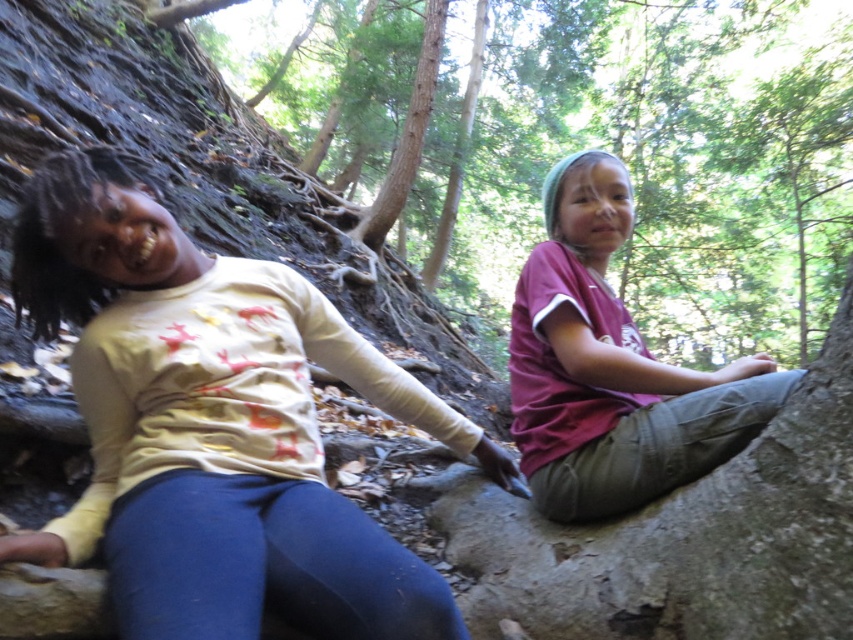
Does green leafy tree at upper center have a greater width compared to maroon fabric shirt at center?

Indeed, green leafy tree at upper center has a greater width compared to maroon fabric shirt at center.

Is green leafy tree at upper center above maroon fabric shirt at center?

Yes, green leafy tree at upper center is above maroon fabric shirt at center.

Which is behind, point (753, 236) or point (596, 497)?

Point (753, 236)

This screenshot has width=853, height=640. I want to click on green leafy tree at upper center, so click(x=674, y=161).

Can you confirm if green leafy tree at upper center is bigger than white cotton shirt at left?

Yes.

Is green leafy tree at upper center shorter than white cotton shirt at left?

In fact, green leafy tree at upper center may be taller than white cotton shirt at left.

This screenshot has height=640, width=853. What do you see at coordinates (674, 161) in the screenshot?
I see `green leafy tree at upper center` at bounding box center [674, 161].

At what (x,y) coordinates should I click in order to perform the action: click on green leafy tree at upper center. Please return your answer as a coordinate pair (x, y). The image size is (853, 640). Looking at the image, I should click on (674, 161).

Does white cotton shirt at left have a smaller size compared to maroon fabric shirt at center?

No, white cotton shirt at left is not smaller than maroon fabric shirt at center.

Locate an element on the screen. This screenshot has width=853, height=640. white cotton shirt at left is located at coordinates (213, 426).